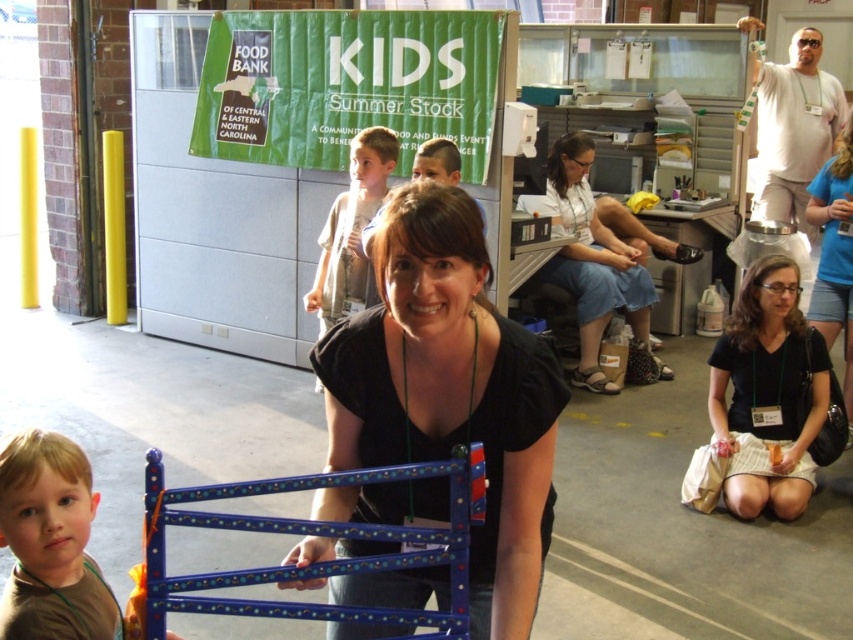
You are a photographer adjusting your camera to focus on two points in the image. The first point is at coordinates point (596, 374) and the second is at point (825, 280). Which point is closer to your camera lens?

Point (596, 374) is closer to the camera lens than point (825, 280) because it is further to the camera.

You are organizing a charity event and need to ensure all volunteers are wearing shirts that meet the minimum width requirement of 30 cm. You observe two volunteers wearing the matte black shirt at center and the black fabric shirt at center. Which volunteer is more likely to have a shirt that meets the requirement?

The black fabric shirt at center is wider than the matte black shirt at center, so the volunteer wearing the black fabric shirt at center is more likely to meet the 30 cm width requirement.